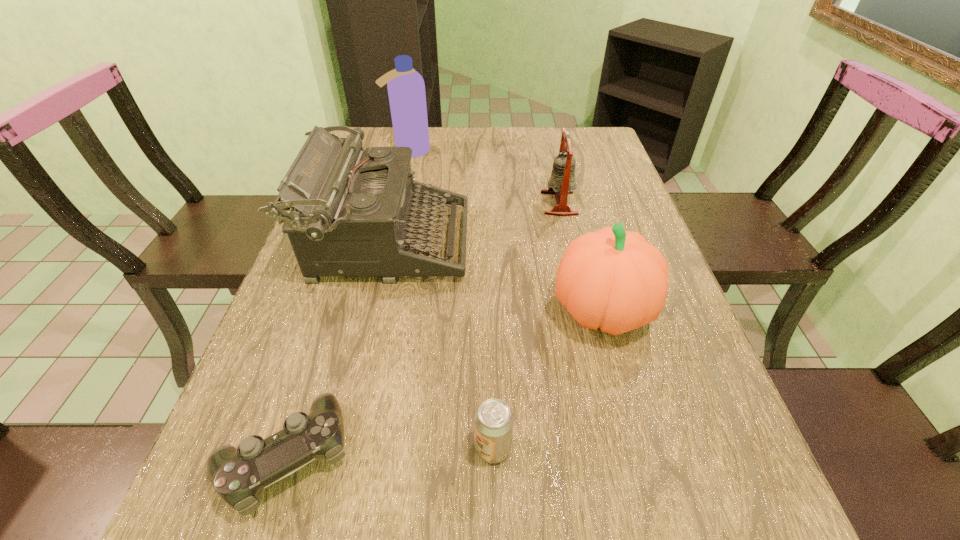
Identify the location of free space located on the back of the bell. (544, 139).

At what (x,y) coordinates should I click in order to perform the action: click on vacant space located on the left of the third object from right to left. Please return your answer as a coordinate pair (x, y). Looking at the image, I should click on (284, 448).

Identify the location of vacant region located 0.110m on the back of the shortest object. (320, 350).

This screenshot has height=540, width=960. Identify the location of object situated at the far edge. (406, 89).

Locate an element on the screen. The width and height of the screenshot is (960, 540). shampoo present at the left edge is located at coordinates (406, 89).

This screenshot has width=960, height=540. I want to click on typewriter positioned at the left edge, so click(353, 212).

Where is `control present at the left edge`? The image size is (960, 540). control present at the left edge is located at coordinates (238, 475).

I want to click on pumpkin located in the right edge section of the desktop, so click(x=612, y=279).

At what (x,y) coordinates should I click in order to perform the action: click on bell located at the right edge. Please return your answer as a coordinate pair (x, y). The image size is (960, 540). Looking at the image, I should click on (562, 182).

The width and height of the screenshot is (960, 540). Identify the location of object that is at the far left corner. (406, 89).